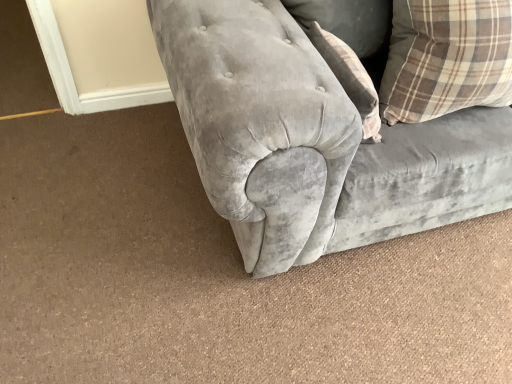
Find the location of a particular element. The image size is (512, 384). velvet gray couch at center is located at coordinates (313, 141).

This screenshot has width=512, height=384. What do you see at coordinates (313, 141) in the screenshot?
I see `velvet gray couch at center` at bounding box center [313, 141].

I want to click on brown plaid pillow at upper right, so click(x=446, y=58).

Image resolution: width=512 pixels, height=384 pixels. Describe the element at coordinates (446, 58) in the screenshot. I see `brown plaid pillow at upper right` at that location.

Measure the distance between brown plaid pillow at upper right and camera.

The depth of brown plaid pillow at upper right is 3.33 feet.

This screenshot has width=512, height=384. What are the coordinates of `velvet gray couch at center` in the screenshot? It's located at (313, 141).

Would you say velvet gray couch at center is to the left or to the right of brown plaid pillow at upper right in the picture?

In the image, velvet gray couch at center appears on the right side of brown plaid pillow at upper right.

Relative to brown plaid pillow at upper right, is velvet gray couch at center in front or behind?

In the image, velvet gray couch at center appears in front of brown plaid pillow at upper right.

Which is in front, point (350, 191) or point (412, 107)?

The point (350, 191) is closer.

From the image's perspective, is velvet gray couch at center above or below brown plaid pillow at upper right?

velvet gray couch at center is above brown plaid pillow at upper right.

From a real-world perspective, is velvet gray couch at center beneath brown plaid pillow at upper right?

Correct, in the physical world, velvet gray couch at center is lower than brown plaid pillow at upper right.

In the scene shown: Considering the sizes of objects velvet gray couch at center and brown plaid pillow at upper right in the image provided, who is thinner, velvet gray couch at center or brown plaid pillow at upper right?

brown plaid pillow at upper right.

Considering the sizes of objects velvet gray couch at center and brown plaid pillow at upper right in the image provided, who is taller, velvet gray couch at center or brown plaid pillow at upper right?

With more height is velvet gray couch at center.

Does velvet gray couch at center have a smaller size compared to brown plaid pillow at upper right?

Actually, velvet gray couch at center might be larger than brown plaid pillow at upper right.

Do you think velvet gray couch at center is within brown plaid pillow at upper right, or outside of it?

velvet gray couch at center lies outside brown plaid pillow at upper right.

Are velvet gray couch at center and brown plaid pillow at upper right located far from each other?

velvet gray couch at center is near brown plaid pillow at upper right, not far away.

Could you tell me if velvet gray couch at center is facing brown plaid pillow at upper right?

Yes, velvet gray couch at center is oriented towards brown plaid pillow at upper right.

How many degrees apart are the facing directions of velvet gray couch at center and brown plaid pillow at upper right?

There is a 0.962-degree angle between the facing directions of velvet gray couch at center and brown plaid pillow at upper right.

Find the location of a particular element. pillow that appears behind the velvet gray couch at center is located at coordinates (446, 58).

From the picture: Is brown plaid pillow at upper right to the left or to the right of velvet gray couch at center in the image?

Clearly, brown plaid pillow at upper right is on the left of velvet gray couch at center in the image.

Does brown plaid pillow at upper right come in front of velvet gray couch at center?

No, it is behind velvet gray couch at center.

Which is nearer, (449, 65) or (242, 182)?

Point (449, 65) appears to be farther away from the viewer than point (242, 182).

From the image's perspective, is brown plaid pillow at upper right positioned above or below velvet gray couch at center?

Clearly, from the image's perspective, brown plaid pillow at upper right is below velvet gray couch at center.

From a real-world perspective, which object stands above the other?

brown plaid pillow at upper right.

Does brown plaid pillow at upper right have a greater width compared to velvet gray couch at center?

No.

Can you confirm if brown plaid pillow at upper right is taller than velvet gray couch at center?

No, brown plaid pillow at upper right is not taller than velvet gray couch at center.

Does brown plaid pillow at upper right have a larger size compared to velvet gray couch at center?

No.

Do you think brown plaid pillow at upper right is within velvet gray couch at center, or outside of it?

brown plaid pillow at upper right is located inside velvet gray couch at center.

Is there a large distance between brown plaid pillow at upper right and velvet gray couch at center?

That's not correct — brown plaid pillow at upper right is a little close to velvet gray couch at center.

Is brown plaid pillow at upper right facing away from velvet gray couch at center?

Yes.

Image resolution: width=512 pixels, height=384 pixels. I want to click on pillow behind the velvet gray couch at center, so click(x=446, y=58).

Where is `studio couch on the right side of brown plaid pillow at upper right`? Image resolution: width=512 pixels, height=384 pixels. studio couch on the right side of brown plaid pillow at upper right is located at coordinates (313, 141).

There is a velvet gray couch at center. At what (x,y) coordinates should I click in order to perform the action: click on pillow above it (from a real-world perspective). Please return your answer as a coordinate pair (x, y). The height and width of the screenshot is (384, 512). Looking at the image, I should click on (446, 58).